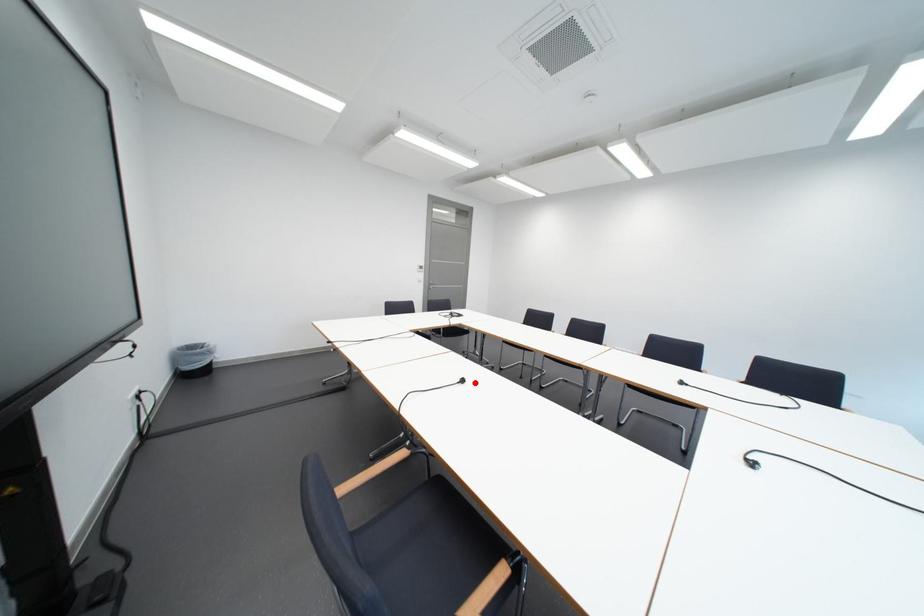
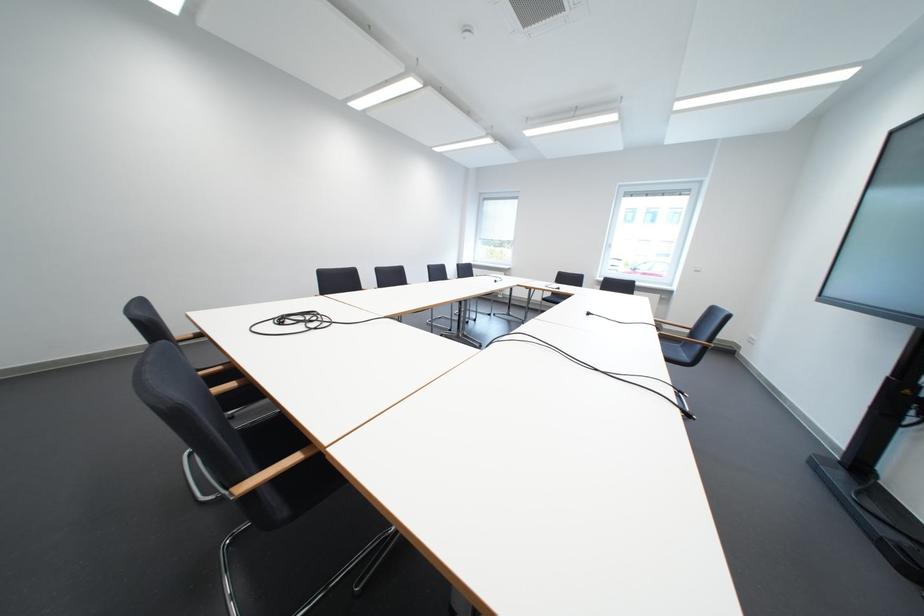
Question: I am providing you with two images of the same scene from different viewpoints. A red point is marked on the first image. At the location where the point appears in image 1, is it still visible in image 2?

Choices:
 (A) Yes
 (B) No

Answer: (A)